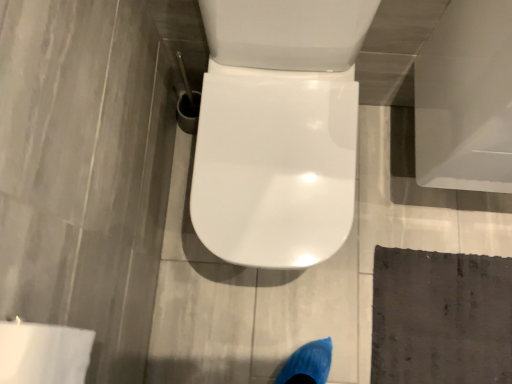
The image size is (512, 384). What do you see at coordinates (42, 353) in the screenshot?
I see `white paper at lower left` at bounding box center [42, 353].

The image size is (512, 384). What are the coordinates of `white paper at lower left` in the screenshot? It's located at (42, 353).

Image resolution: width=512 pixels, height=384 pixels. Identify the location of white paper at lower left. (42, 353).